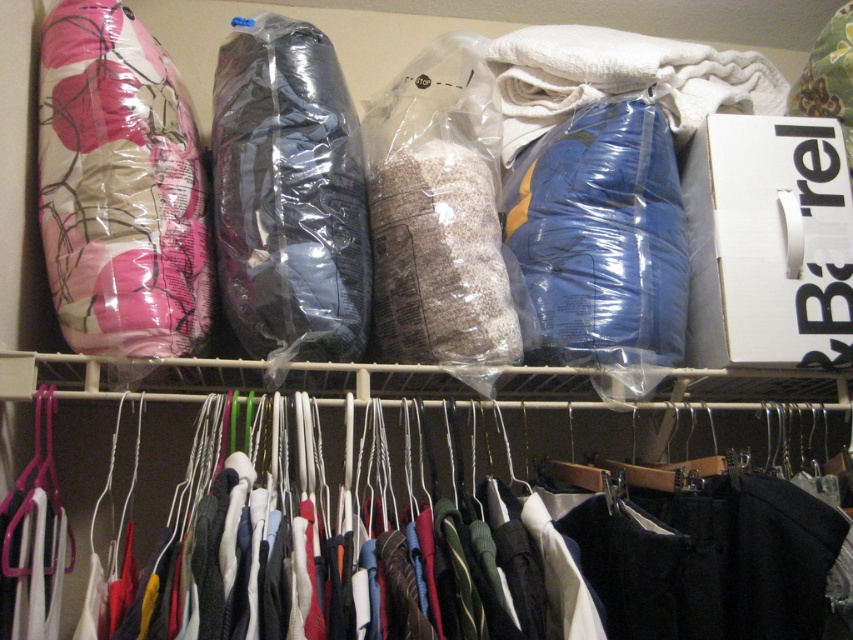
Question: Which point is farther to the camera?

Choices:
 (A) matte black sleeping bag at center
 (B) polyester hangers at center
 (C) white textured blanket at upper right
 (D) pink floral fabric pillow at upper left

Answer: (C)

Question: Is matte black sleeping bag at center further to camera compared to white textured blanket at upper right?

Choices:
 (A) no
 (B) yes

Answer: (A)

Question: Is polyester hangers at center closer to the viewer compared to pink floral fabric pillow at upper left?

Choices:
 (A) no
 (B) yes

Answer: (B)

Question: Based on their relative distances, which object is farther from the matte black sleeping bag at center?

Choices:
 (A) polyester hangers at center
 (B) pink floral fabric pillow at upper left
 (C) white textured blanket at upper right

Answer: (C)

Question: Can you confirm if polyester hangers at center is positioned to the right of matte black sleeping bag at center?

Choices:
 (A) yes
 (B) no

Answer: (A)

Question: Which point is closer to the camera?

Choices:
 (A) (514, 33)
 (B) (252, 291)

Answer: (B)